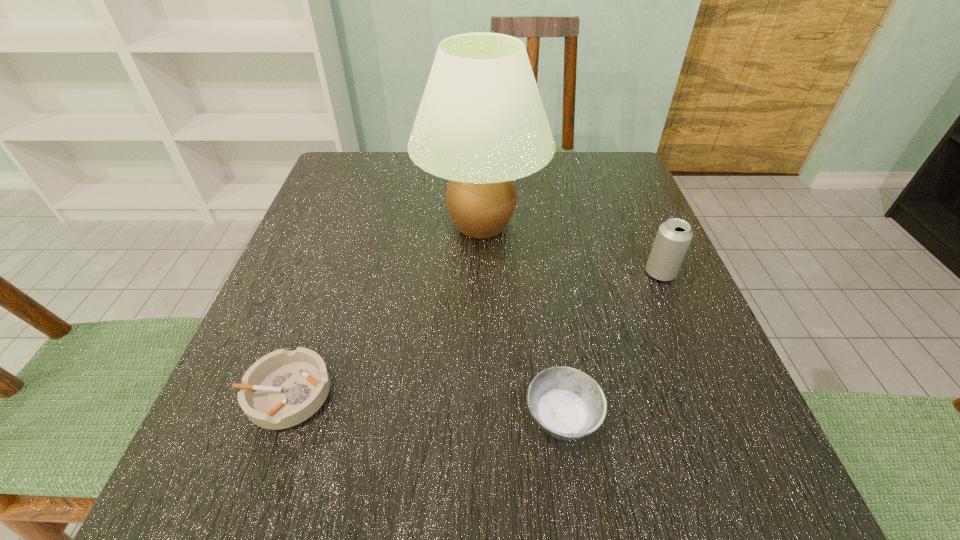
At what (x,y) coordinates should I click in order to perform the action: click on vacant area situated on the left of the beer can. Please return your answer as a coordinate pair (x, y). The width and height of the screenshot is (960, 540). Looking at the image, I should click on (441, 273).

Find the location of a particular element. The height and width of the screenshot is (540, 960). vacant region located on the back of the taller ashtray is located at coordinates point(547,313).

Image resolution: width=960 pixels, height=540 pixels. I want to click on free spot located on the back of the shortest object, so click(334, 260).

Identify the location of object located at the far edge. Image resolution: width=960 pixels, height=540 pixels. (481, 123).

What are the coordinates of `object at the near edge` in the screenshot? It's located at (567, 403).

Where is `object that is at the left edge`? object that is at the left edge is located at coordinates (284, 388).

The width and height of the screenshot is (960, 540). Find the location of `object that is at the right edge`. object that is at the right edge is located at coordinates (673, 238).

Where is `vacant area at the far edge`? The image size is (960, 540). vacant area at the far edge is located at coordinates (568, 197).

Locate an element on the screen. free space at the near edge is located at coordinates (588, 487).

Where is `free space at the left edge of the desktop`? The width and height of the screenshot is (960, 540). free space at the left edge of the desktop is located at coordinates (259, 313).